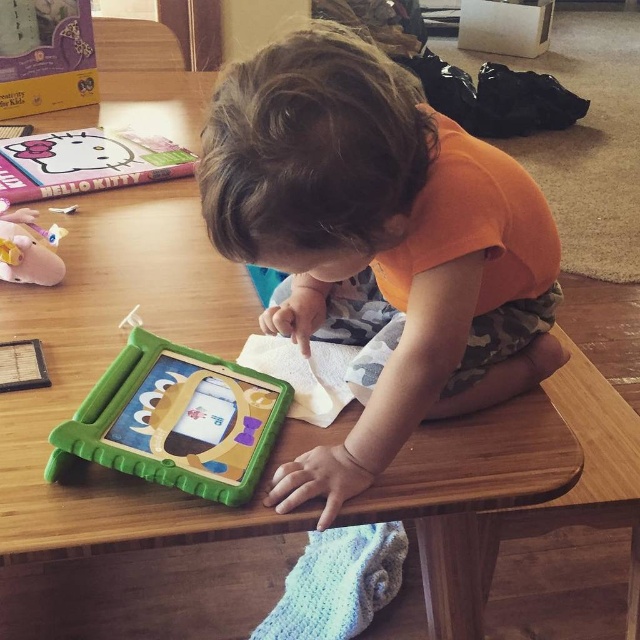
Does green plastic tablet at center appear on the left side of pink rubber piggy bank at left?

In fact, green plastic tablet at center is to the right of pink rubber piggy bank at left.

Is point (184, 364) more distant than point (45, 253)?

No, it is not.

The image size is (640, 640). Find the location of `green plastic tablet at center`. green plastic tablet at center is located at coordinates (177, 420).

The image size is (640, 640). What do you see at coordinates (380, 240) in the screenshot?
I see `orange cotton toddler at center` at bounding box center [380, 240].

Is point (342, 241) positioned after point (44, 259)?

No, (342, 241) is in front of (44, 259).

Does point (508, 218) come farther from viewer compared to point (8, 273)?

That is False.

The image size is (640, 640). I want to click on orange cotton toddler at center, so click(380, 240).

Can you confirm if orange cotton toddler at center is positioned below green plastic tablet at center?

No.

Which is more to the right, orange cotton toddler at center or green plastic tablet at center?

orange cotton toddler at center

Where is `orange cotton toddler at center`? Image resolution: width=640 pixels, height=640 pixels. orange cotton toddler at center is located at coordinates (380, 240).